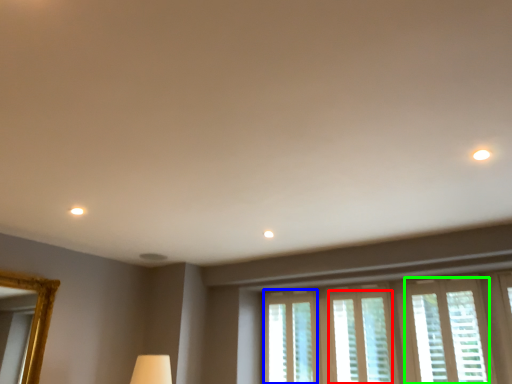
Question: Which object is the closest to the window (highlighted by a red box)? Choose among these: window (highlighted by a blue box) or window (highlighted by a green box).

Choices:
 (A) window
 (B) window

Answer: (B)